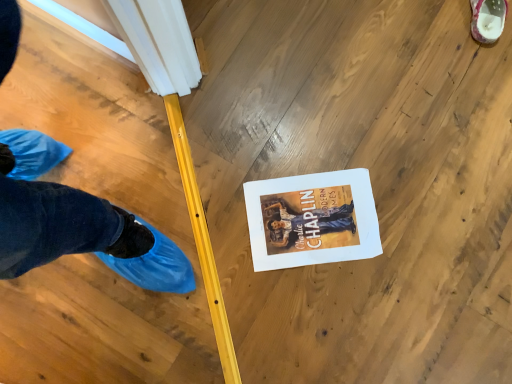
Question: From the image's perspective, is white paper at center located above or below white textured shoe at upper right?

Choices:
 (A) below
 (B) above

Answer: (A)

Question: In the image, is white paper at center on the left side or the right side of white textured shoe at upper right?

Choices:
 (A) left
 (B) right

Answer: (A)

Question: Is point (335, 248) positioned closer to the camera than point (474, 21)?

Choices:
 (A) closer
 (B) farther

Answer: (A)

Question: From a real-world perspective, is white textured shoe at upper right above or below white paper at center?

Choices:
 (A) above
 (B) below

Answer: (A)

Question: Is point (477, 21) closer or farther from the camera than point (354, 228)?

Choices:
 (A) farther
 (B) closer

Answer: (A)

Question: From their relative heights in the image, would you say white textured shoe at upper right is taller or shorter than white paper at center?

Choices:
 (A) tall
 (B) short

Answer: (A)

Question: In terms of width, does white textured shoe at upper right look wider or thinner when compared to white paper at center?

Choices:
 (A) wide
 (B) thin

Answer: (B)